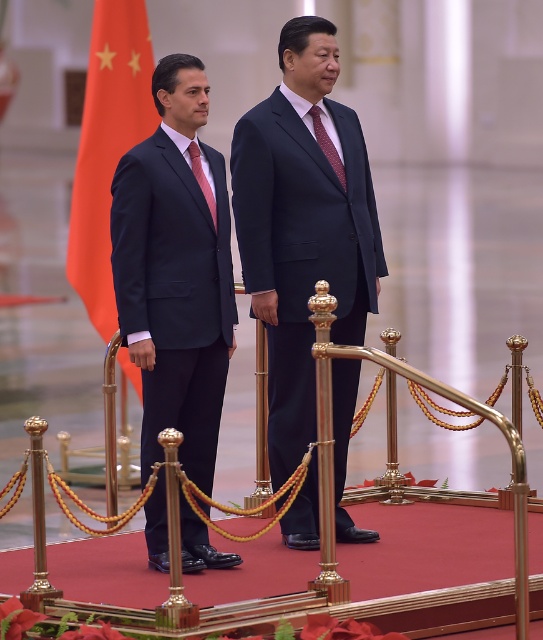
Is orange fabric flag at left wider than pink satin tie at center?

Yes.

The image size is (543, 640). What do you see at coordinates (108, 147) in the screenshot?
I see `orange fabric flag at left` at bounding box center [108, 147].

Who is more distant from viewer, (x=104, y=38) or (x=197, y=148)?

The point (x=104, y=38) is behind.

This screenshot has width=543, height=640. Find the location of `orange fabric flag at left`. orange fabric flag at left is located at coordinates (108, 147).

Which of these two, matte black suit at left or orange fabric flag at left, stands shorter?

matte black suit at left

Find the location of a particular element. The image size is (543, 640). matte black suit at left is located at coordinates (174, 273).

Which of these two, black matte suit at center or pink satin tie at center, stands shorter?

pink satin tie at center

Where is `black matte suit at center`? black matte suit at center is located at coordinates (302, 227).